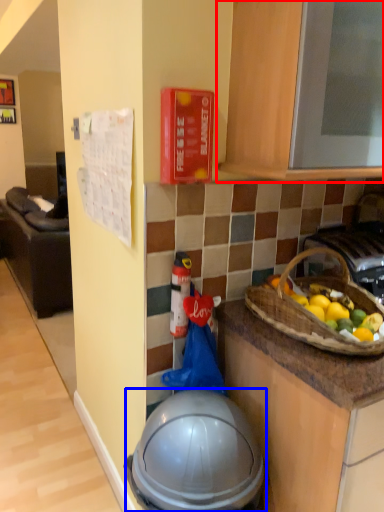
Question: Which point is further to the camera, cabinetry (highlighted by a red box) or helmet (highlighted by a blue box)?

Choices:
 (A) cabinetry
 (B) helmet

Answer: (B)